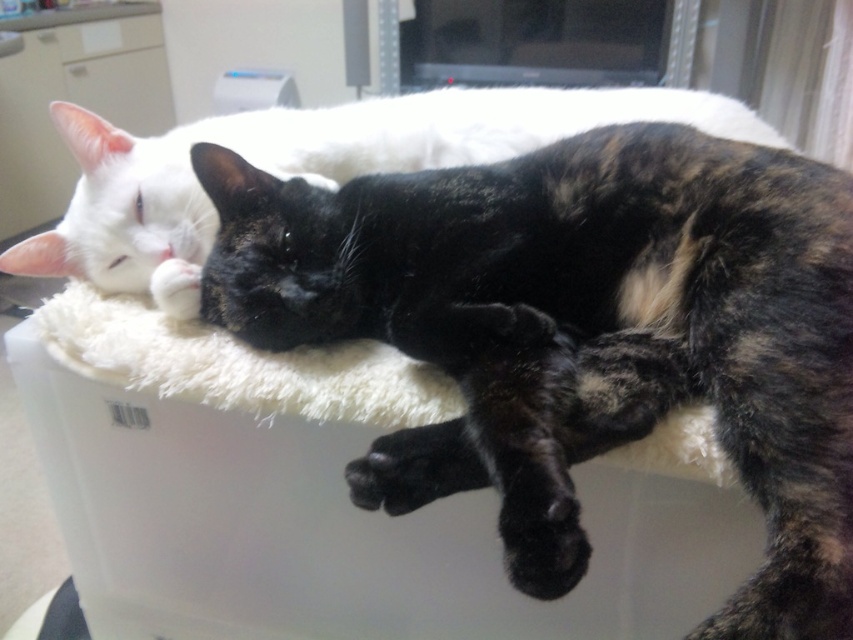
Question: Which is farther from the white fluffy cat bed at center?

Choices:
 (A) tortoiseshell fur cat at center
 (B) white fluffy cat at upper center

Answer: (B)

Question: Which object is the farthest from the white fluffy cat at upper center?

Choices:
 (A) white fluffy cat bed at center
 (B) tortoiseshell fur cat at center

Answer: (B)

Question: Is tortoiseshell fur cat at center to the left of white fluffy cat bed at center from the viewer's perspective?

Choices:
 (A) yes
 (B) no

Answer: (B)

Question: Is white fluffy cat at upper center further to the viewer compared to white fluffy cat bed at center?

Choices:
 (A) yes
 (B) no

Answer: (A)

Question: Is tortoiseshell fur cat at center to the right of white fluffy cat bed at center from the viewer's perspective?

Choices:
 (A) yes
 (B) no

Answer: (A)

Question: Among these objects, which one is farthest from the camera?

Choices:
 (A) white fluffy cat at upper center
 (B) white fluffy cat bed at center

Answer: (A)